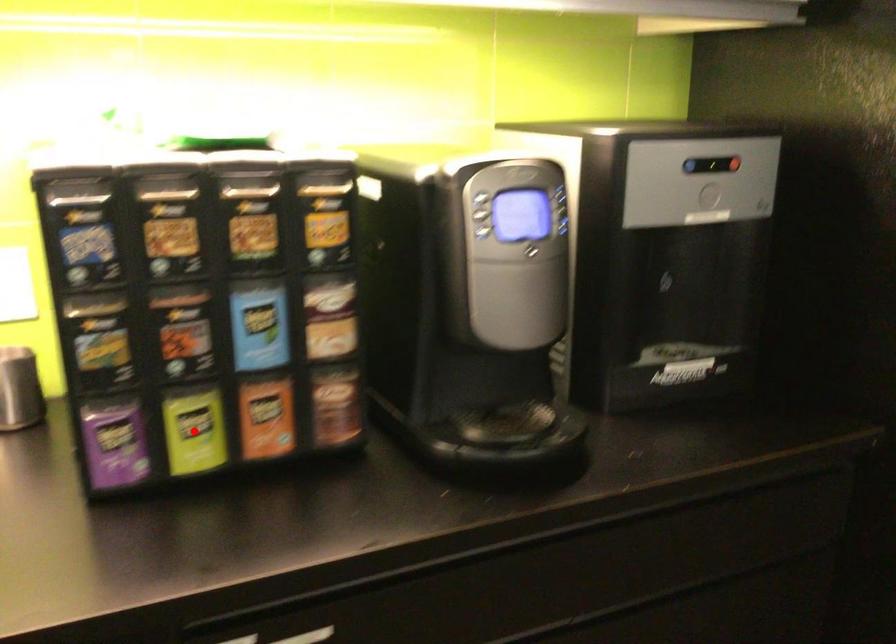
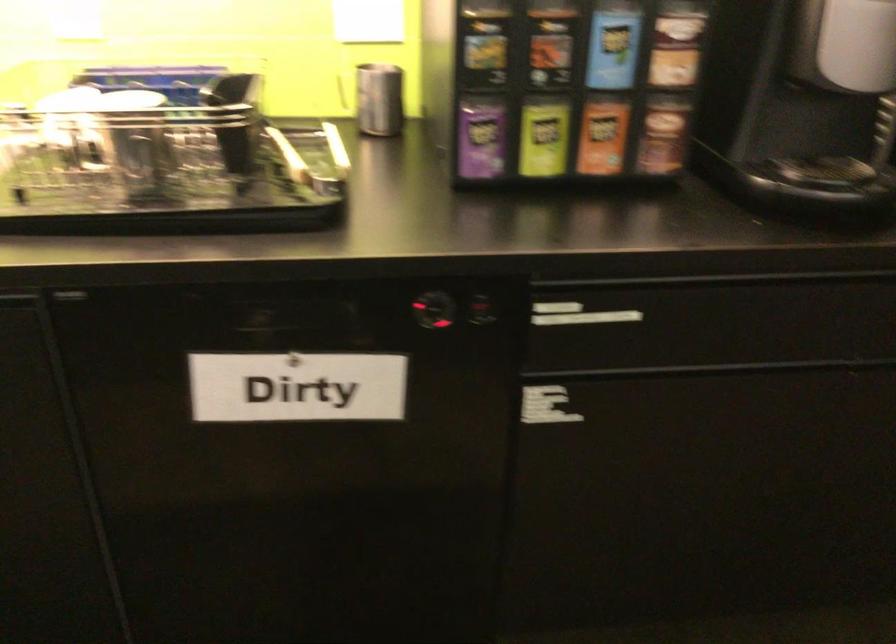
The point at the highlighted location is marked in the first image. Where is the corresponding point in the second image?

(543, 138)